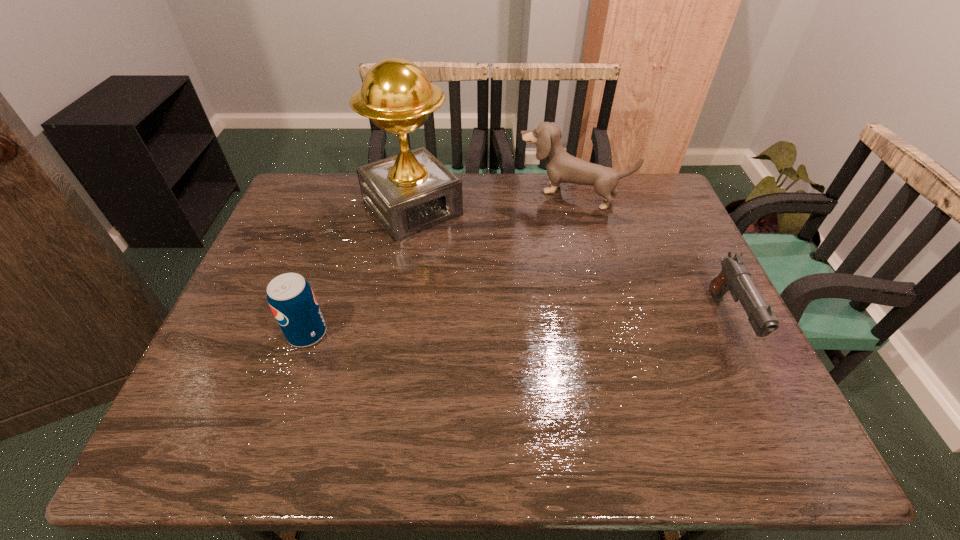
The width and height of the screenshot is (960, 540). Identify the location of vacant space on the desktop that is between the pop and the rightmost object and is positioned at the face of the third shortest object. (477, 328).

Locate an element on the screen. vacant spot on the desktop that is between the pop and the gun and is positioned on the front-facing side of the tallest object is located at coordinates (517, 327).